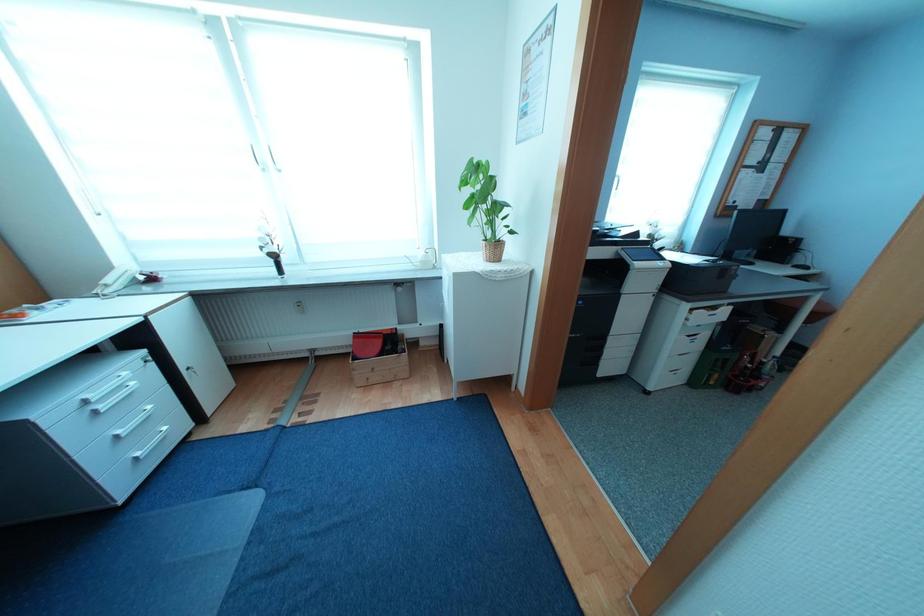
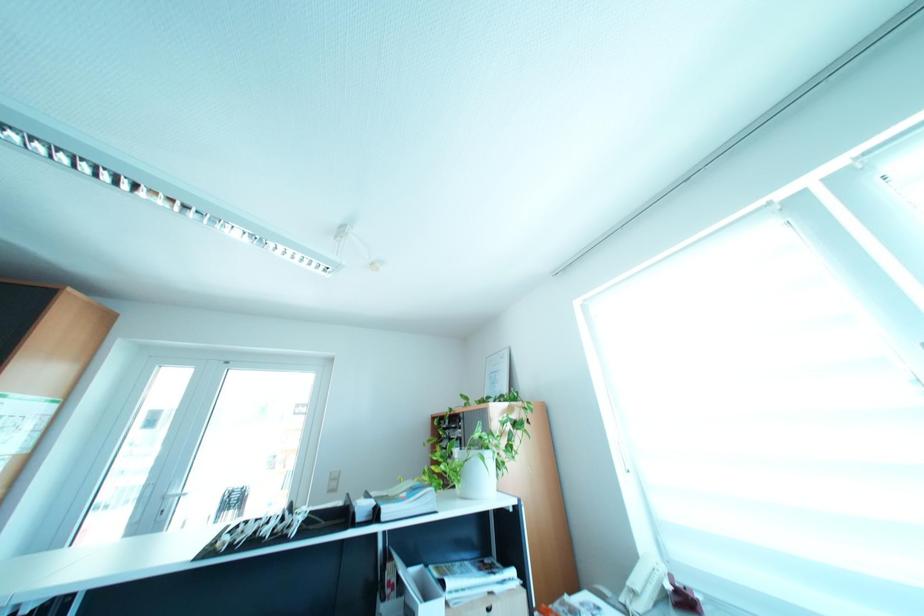
The images are taken continuously from a first-person perspective. In which direction is your viewpoint rotating?

The camera rotated toward left-up.